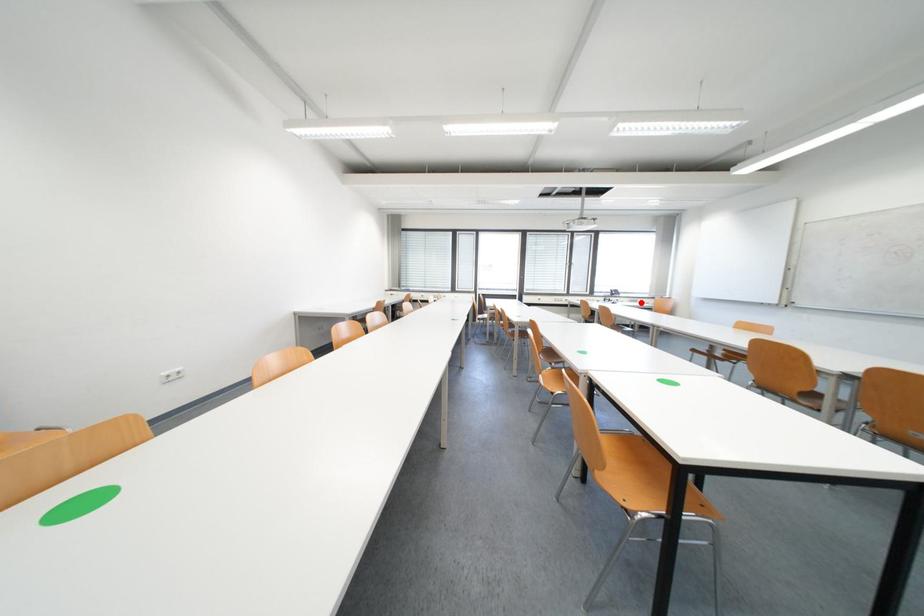
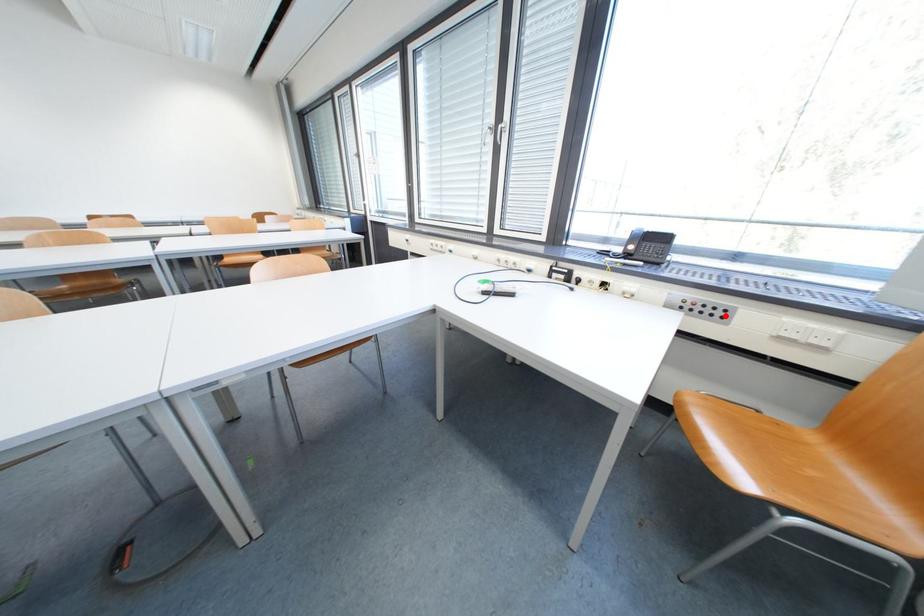
I am providing you with two images of the same scene from different viewpoints. A red point is marked on the first image and another point is marked on the second image. Are the points marked in image1 and image2 representing the same 3D position?

Yes